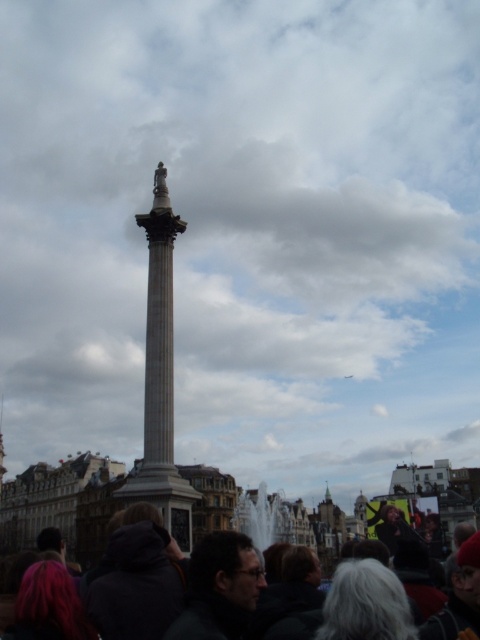
Question: Does dark gray clothing at lower center appear on the left side of marble column at center?

Choices:
 (A) yes
 (B) no

Answer: (B)

Question: Which object is closer to the camera taking this photo?

Choices:
 (A) marble column at center
 (B) dark gray clothing at lower center

Answer: (B)

Question: Among these points, which one is farthest from the camera?

Choices:
 (A) (189, 492)
 (B) (145, 522)

Answer: (A)

Question: Which point appears farthest from the camera in this image?

Choices:
 (A) (171, 618)
 (B) (166, 266)

Answer: (B)

Question: Is dark gray clothing at lower center bigger than marble column at center?

Choices:
 (A) no
 (B) yes

Answer: (A)

Question: Is dark gray clothing at lower center further to the viewer compared to marble column at center?

Choices:
 (A) yes
 (B) no

Answer: (B)